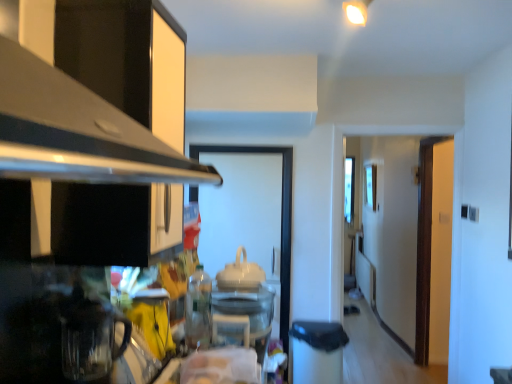
Question: Can transparent glass door at center be found inside transparent glass coffee pot at lower left, the first appliance viewed from the front?

Choices:
 (A) yes
 (B) no

Answer: (B)

Question: Is the depth of transparent glass coffee pot at lower left, the 4th appliance when ordered from right to left, greater than that of transparent glass door at center?

Choices:
 (A) no
 (B) yes

Answer: (A)

Question: Can you confirm if transparent glass coffee pot at lower left, the first appliance viewed from the front, is taller than transparent glass door at center?

Choices:
 (A) no
 (B) yes

Answer: (A)

Question: Considering the relative sizes of transparent glass coffee pot at lower left, the 4th appliance from the back, and transparent glass door at center in the image provided, is transparent glass coffee pot at lower left, the 4th appliance from the back, thinner than transparent glass door at center?

Choices:
 (A) yes
 (B) no

Answer: (B)

Question: From the image's perspective, is transparent glass coffee pot at lower left, the first appliance viewed from the front, located above transparent glass door at center?

Choices:
 (A) yes
 (B) no

Answer: (A)

Question: Considering the relative sizes of transparent glass coffee pot at lower left, the first appliance viewed from the front, and transparent glass door at center in the image provided, is transparent glass coffee pot at lower left, the first appliance viewed from the front, wider than transparent glass door at center?

Choices:
 (A) no
 (B) yes

Answer: (B)

Question: Is black metallic exhaust hood at upper left wider than brown wooden door at right?

Choices:
 (A) no
 (B) yes

Answer: (B)

Question: Does black metallic exhaust hood at upper left have a lesser height compared to brown wooden door at right?

Choices:
 (A) yes
 (B) no

Answer: (A)

Question: Considering the relative sizes of black metallic exhaust hood at upper left and brown wooden door at right in the image provided, is black metallic exhaust hood at upper left taller than brown wooden door at right?

Choices:
 (A) yes
 (B) no

Answer: (B)

Question: Does black metallic exhaust hood at upper left come in front of brown wooden door at right?

Choices:
 (A) yes
 (B) no

Answer: (A)

Question: From a real-world perspective, is black metallic exhaust hood at upper left located beneath brown wooden door at right?

Choices:
 (A) yes
 (B) no

Answer: (B)

Question: Is black metallic exhaust hood at upper left positioned beyond the bounds of brown wooden door at right?

Choices:
 (A) yes
 (B) no

Answer: (A)

Question: Can you see transparent glass coffee pot at lower left, the first appliance viewed from the left, touching brown wooden door at right?

Choices:
 (A) no
 (B) yes

Answer: (A)